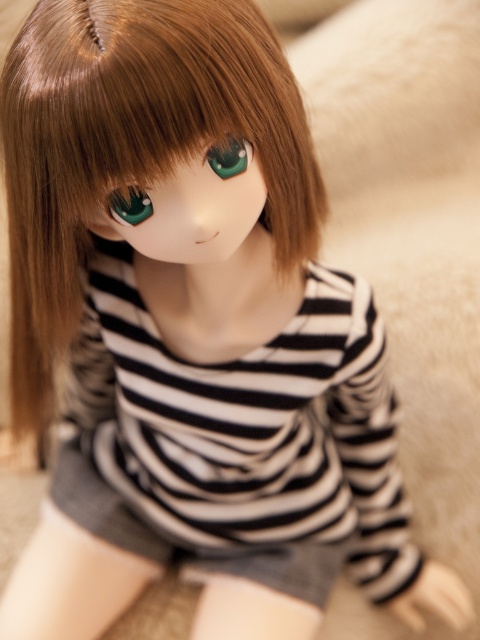
The scene shows a doll with a black striped shirt at center and a shiny green eye at center. Based on their positions, which object is located to the right of the other?

The black striped shirt at center is to the right of the shiny green eye at center.